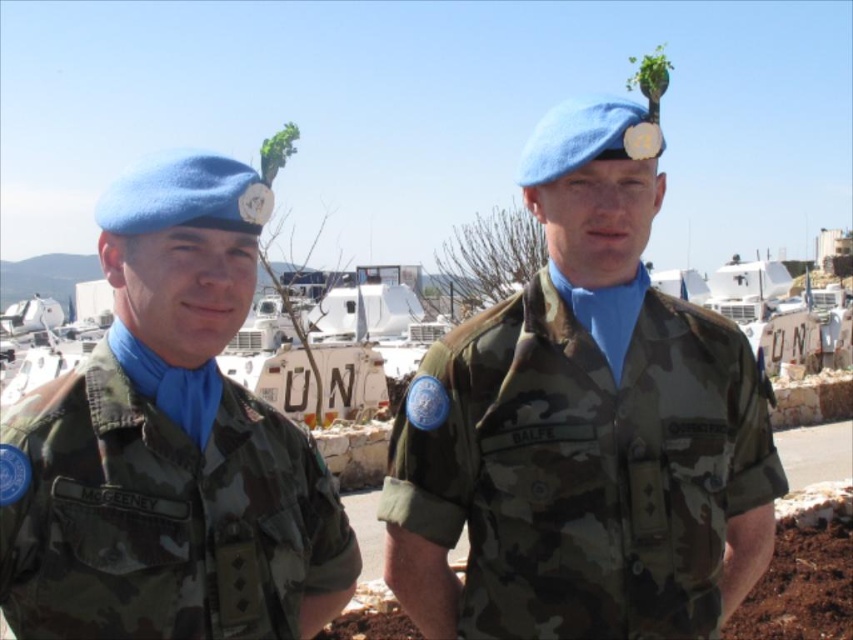
You are a tailor who needs to determine which uniform requires more fabric to make between the camo uniform at center and the camo fabric uniform at left. Based on the image, which one would need more fabric?

The camo uniform at center is larger in size than the camo fabric uniform at left, so it would require more fabric to make.

You are a photographer setting up a shot of the two UN peacekeepers. You need to ensure both the camo uniform at center and the camo fabric uniform at left are fully visible in the frame. Based on their positions and the scene, which uniform might require you to adjust your camera angle to avoid cropping?

The camo uniform at center might be wider than the camo fabric uniform at left, so you might need to adjust the camera angle to ensure the wider camo uniform at center fits without cropping.